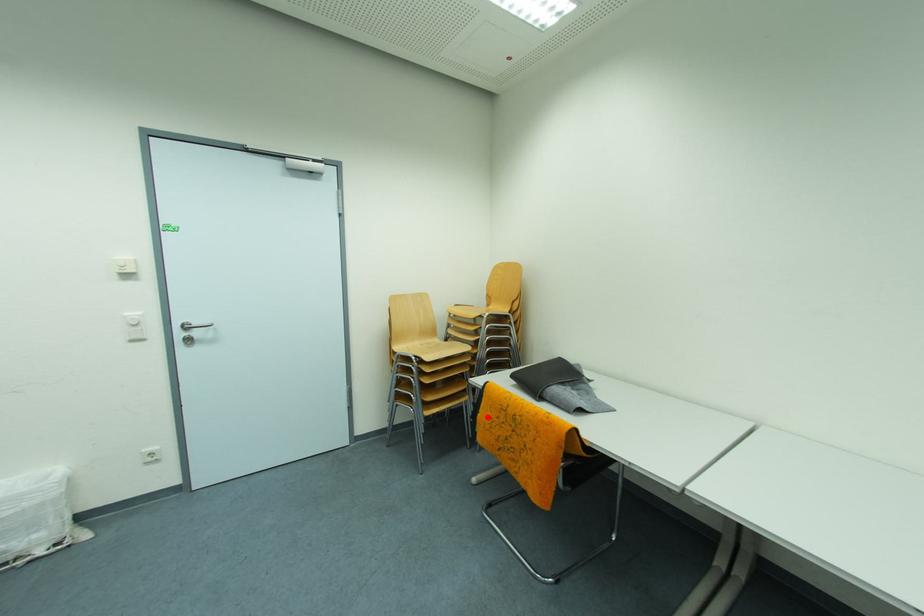
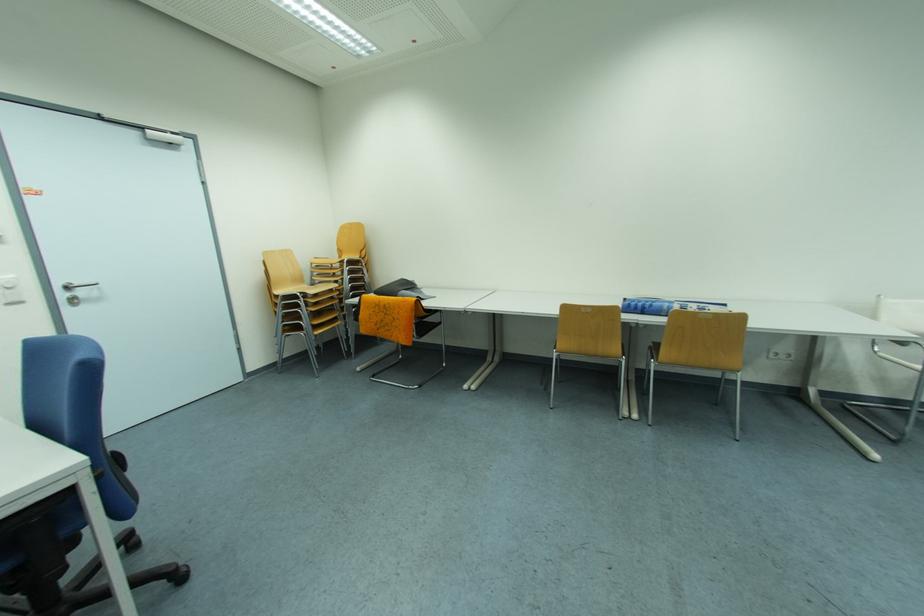
In the second image, find the point that corresponds to the highlighted location in the first image.

(369, 318)